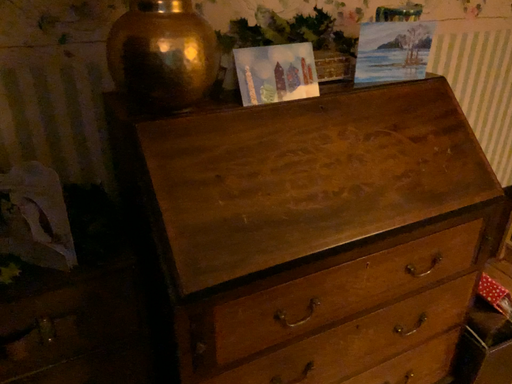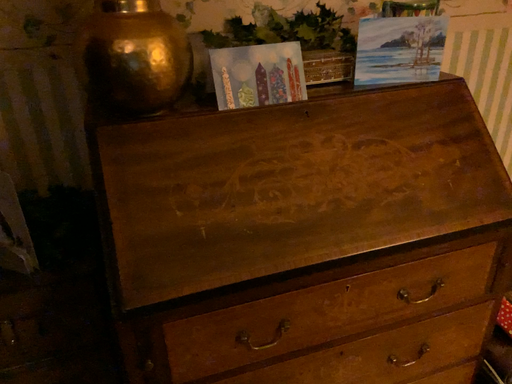
Question: How did the camera likely rotate when shooting the video?

Choices:
 (A) rotated right
 (B) rotated left

Answer: (B)